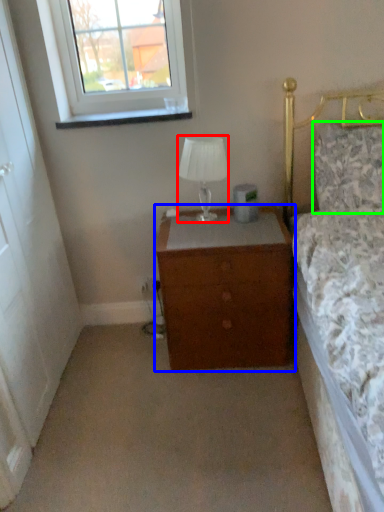
Question: Estimate the real-world distances between objects in this image. Which object is closer to lamp (highlighted by a red box), chest of drawers (highlighted by a blue box) or pillow (highlighted by a green box)?

Choices:
 (A) chest of drawers
 (B) pillow

Answer: (A)